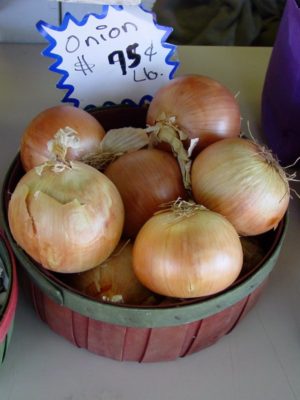
At what (x,y) coordinates should I click in order to perform the action: click on red basket. Please return your answer as a coordinate pair (x, y). This screenshot has width=300, height=400. Looking at the image, I should click on (190, 337).